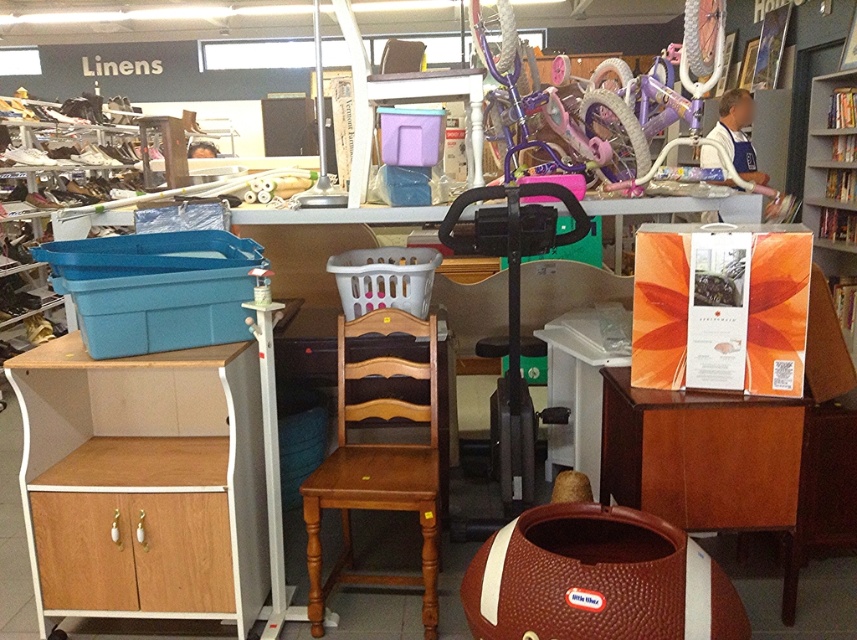
From the picture: Can you confirm if light brown wood chair at center is wider than orange paperboard at upper right?

Yes, light brown wood chair at center is wider than orange paperboard at upper right.

Measure the distance from light brown wood chair at center to orange paperboard at upper right.

A distance of 11.25 feet exists between light brown wood chair at center and orange paperboard at upper right.

Which is in front, point (306, 483) or point (818, 97)?

Positioned in front is point (306, 483).

Find the location of `light brown wood chair at center`. light brown wood chair at center is located at coordinates (378, 465).

Is point (670, 410) more distant than point (54, 592)?

No, (670, 410) is in front of (54, 592).

Which is behind, point (802, 401) or point (120, 604)?

Positioned behind is point (120, 604).

Find the location of a particular element. The width and height of the screenshot is (857, 640). brown wood cabinet at lower right is located at coordinates (705, 461).

Looking at this image, who is more forward, (676, 419) or (840, 282)?

Point (676, 419) is in front.

In order to click on brown wood cabinet at lower right in this screenshot , I will do `click(705, 461)`.